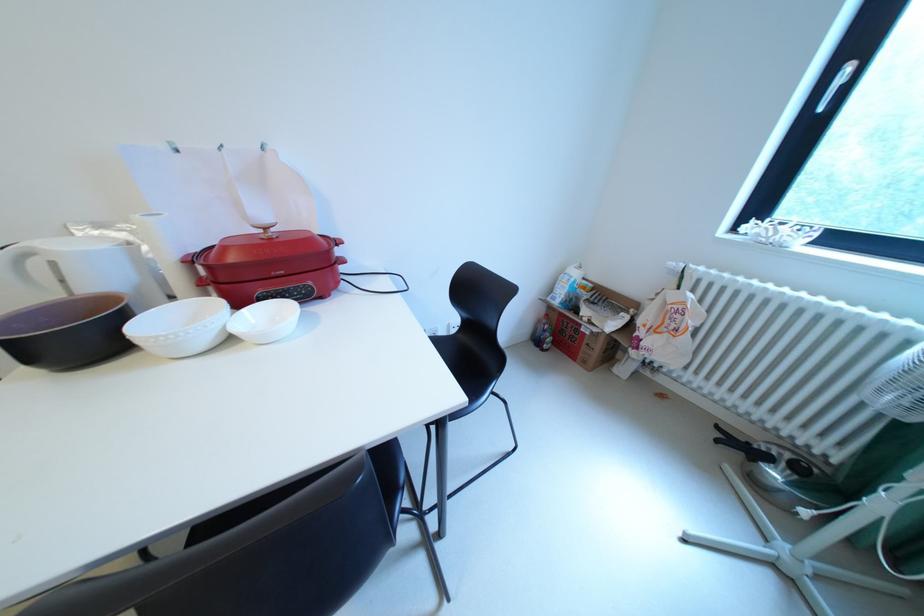
The width and height of the screenshot is (924, 616). Describe the element at coordinates (283, 288) in the screenshot. I see `the red pot side handle` at that location.